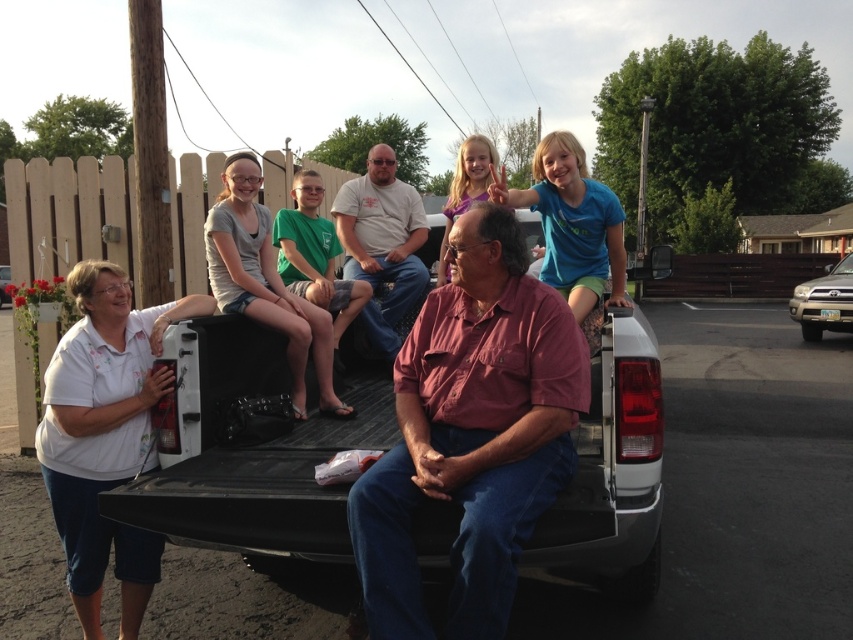
You are a photographer trying to capture a photo of the matte pink shirt at center and the white matte shirt at lower left. Which of the two shirts should you focus on first if you want to ensure both are in the frame without moving the camera?

The matte pink shirt at center is positioned over the white matte shirt at lower left, so you should focus on the matte pink shirt at center first to ensure it stays in the frame while capturing both shirts without moving the camera.

You are a photographer trying to capture a group photo of the people in the truck bed. The matte pink shirt at center and the white matte shirt at lower left are in your frame. Based on their sizes in the photo, which person should you ask to move closer to the camera to balance their visibility?

The matte pink shirt at center is larger in size than the white matte shirt at lower left. To balance their visibility, you should ask the white matte shirt at lower left to move closer to the camera since it appears smaller and needs to be more prominent.

You are trying to decide which adult has more space between them and the truck bed edge. Based on the scene, which adult is positioned wider from the edge of the truck bed? The adults are the matte pink shirt at center and the white matte shirt at lower left.

The matte pink shirt at center is wider than the white matte shirt at lower left, so the adult in the matte pink shirt at center is positioned further away from the truck bed edge.